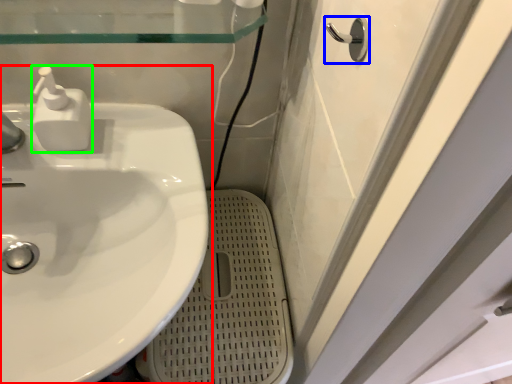
Question: Which object is positioned closest to sink (highlighted by a red box)? Select from door handle (highlighted by a blue box) and soap dispenser (highlighted by a green box).

Choices:
 (A) door handle
 (B) soap dispenser

Answer: (B)